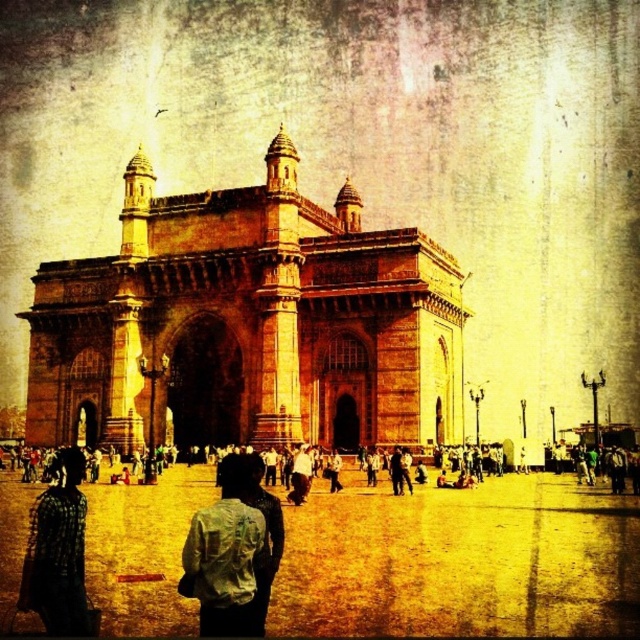
You are standing at the entrance of the Gateway of India monument and see two people wearing a light blue fabric shirt at center and a white cotton shirt at center. You want to greet both individuals. Which one is farther from you?

The light blue fabric shirt at center is 15.99 meters away from the white cotton shirt at center, so the light blue fabric shirt at center is farther away from you.

You are a tourist standing at the entrance of the brown stone gateway of india at center and want to take a photo of the checkered fabric shirt at lower left. Which object should you focus on first to ensure both are in the frame?

You should focus on the brown stone gateway of india at center first because it is closer to you than the checkered fabric shirt at lower left, ensuring both are in the frame.

You are a photographer planning to take a picture of the brown stone gateway of india at center and the checkered fabric shirt at lower left. Based on their sizes in the image, which object would appear larger in the final photo?

The brown stone gateway of india at center appears larger in the final photo because it has a greater height compared to the checkered fabric shirt at lower left.